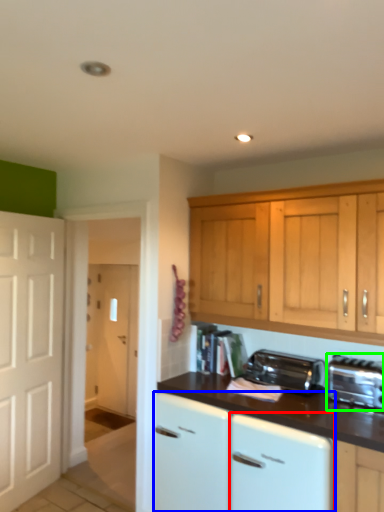
Question: Estimate the real-world distances between objects in this image. Which object is farther from dish washer (highlighted by a red box), cabinetry (highlighted by a blue box) or toaster (highlighted by a green box)?

Choices:
 (A) cabinetry
 (B) toaster

Answer: (B)